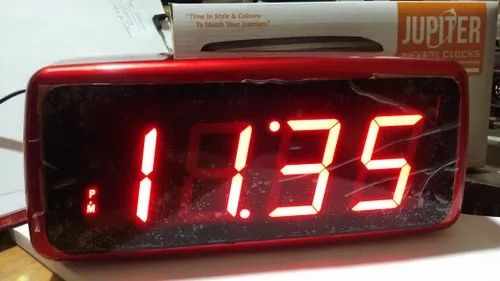
What are the coordinates of `metal spring clamp on clipboard` in the screenshot? It's located at (163, 38).